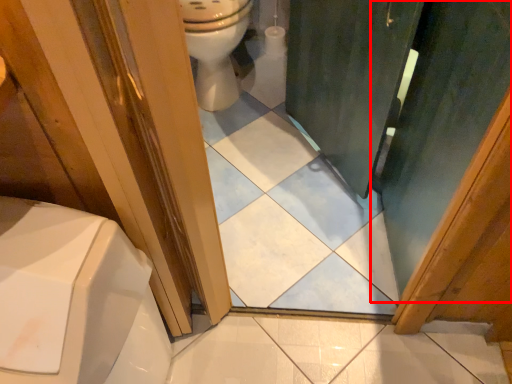
Question: From the image, what is the correct spatial relationship of screen door (annotated by the red box) in relation to toilet?

Choices:
 (A) right
 (B) left

Answer: (A)